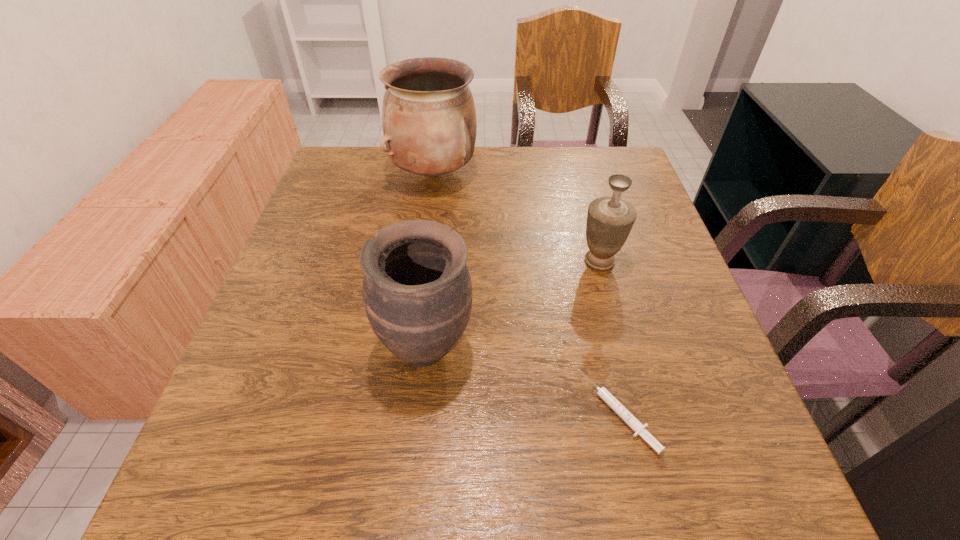
Locate an element on the screen. free space between the nearest urn and the rightmost urn is located at coordinates (513, 305).

You are a GUI agent. You are given a task and a screenshot of the screen. Output one action in this format:
    pyautogui.click(x=<x>, y=<y>)
    Task: Click on the free spot between the farthest urn and the shortest object
    
    Given the screenshot: What is the action you would take?
    pyautogui.click(x=527, y=293)

Where is `empty space between the syringe and the nearest urn`? This screenshot has width=960, height=540. empty space between the syringe and the nearest urn is located at coordinates (523, 380).

This screenshot has width=960, height=540. In order to click on vacant space that's between the nearest urn and the second shortest object in this screenshot , I will do `click(513, 305)`.

Where is `empty space between the nearest urn and the syringe`? This screenshot has height=540, width=960. empty space between the nearest urn and the syringe is located at coordinates (x=523, y=380).

Where is `free spot between the nearest urn and the second farthest object`? free spot between the nearest urn and the second farthest object is located at coordinates coord(513,305).

What are the coordinates of `free space between the syringe and the nearest urn` in the screenshot? It's located at (523, 380).

Where is `free space between the shortest urn and the farthest urn`? This screenshot has height=540, width=960. free space between the shortest urn and the farthest urn is located at coordinates (516, 218).

Where is `the second closest object to the shortest object`? This screenshot has width=960, height=540. the second closest object to the shortest object is located at coordinates (610, 219).

Identify which object is the second nearest to the farthest urn. Please provide its 2D coordinates. Your answer should be formatted as a tuple, i.e. [(x, y)], where the tuple contains the x and y coordinates of a point satisfying the conditions above.

[(417, 291)]